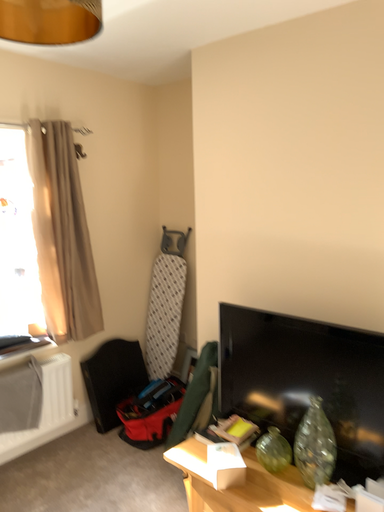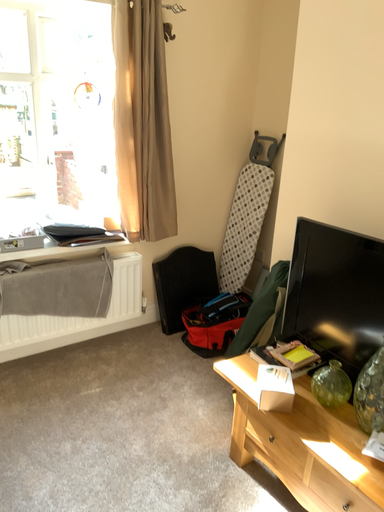
Question: How did the camera likely rotate when shooting the video?

Choices:
 (A) rotated downward
 (B) rotated upward

Answer: (A)